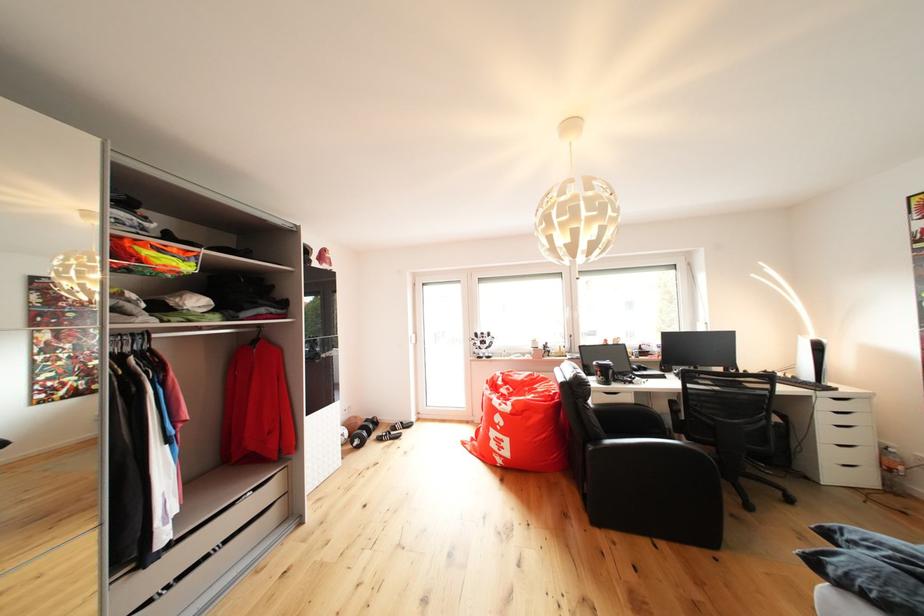
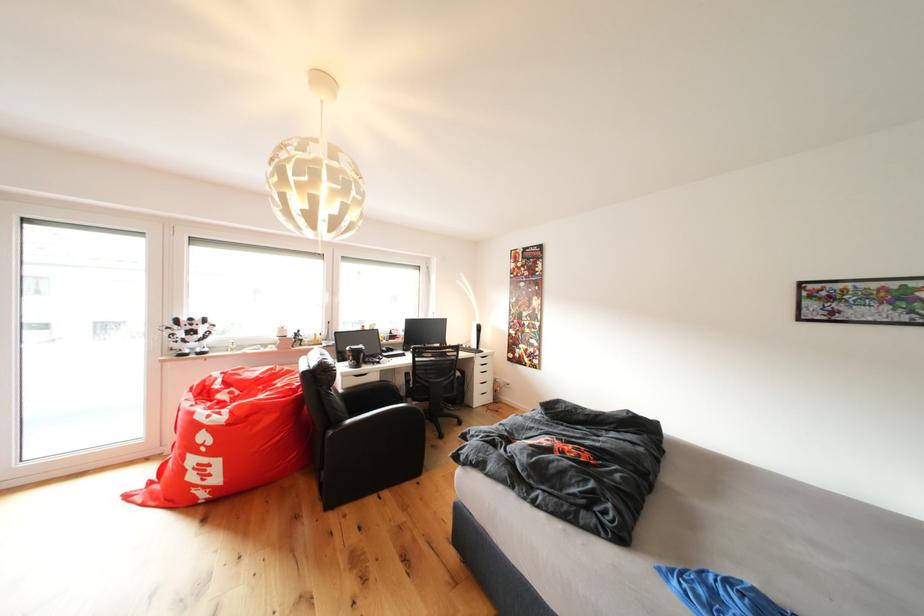
The point at (839, 389) is marked in the first image. Where is the corresponding point in the second image?

(490, 354)